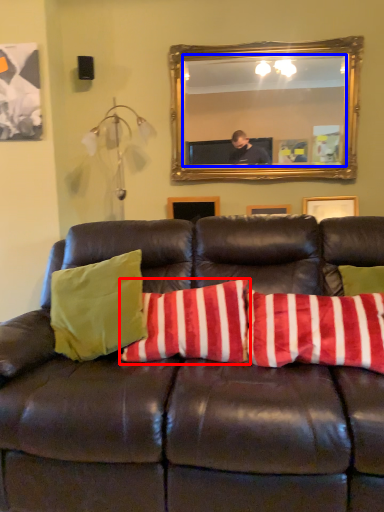
Question: Among these objects, which one is farthest to the camera, pillow (highlighted by a red box) or mirror (highlighted by a blue box)?

Choices:
 (A) pillow
 (B) mirror

Answer: (B)